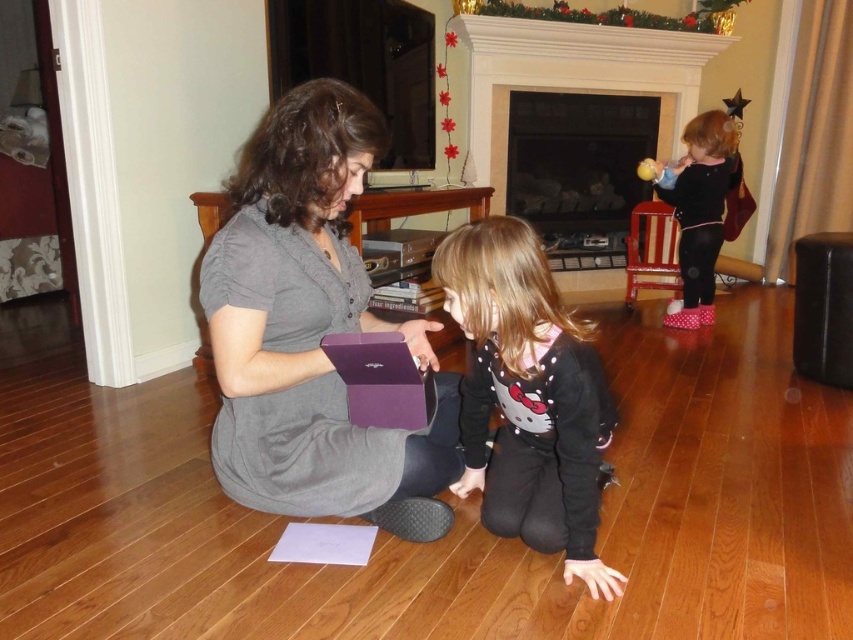
Question: Which object appears closest to the camera in this image?

Choices:
 (A) black matte sweater at center
 (B) dark wood fireplace at center

Answer: (A)

Question: Among these objects, which one is nearest to the camera?

Choices:
 (A) dark wood fireplace at center
 (B) black matte sweater at center

Answer: (B)

Question: Estimate the real-world distances between objects in this image. Which object is farther from the dark wood fireplace at center?

Choices:
 (A) black velvet dress at upper right
 (B) matte gray dress at center
 (C) white marble fireplace at upper center
 (D) black matte sweater at center

Answer: (B)

Question: Is black matte sweater at center closer to the viewer compared to white marble fireplace at upper center?

Choices:
 (A) no
 (B) yes

Answer: (B)

Question: Is white marble fireplace at upper center positioned behind dark wood fireplace at center?

Choices:
 (A) no
 (B) yes

Answer: (A)

Question: Is dark wood fireplace at center positioned before black velvet dress at upper right?

Choices:
 (A) yes
 (B) no

Answer: (B)